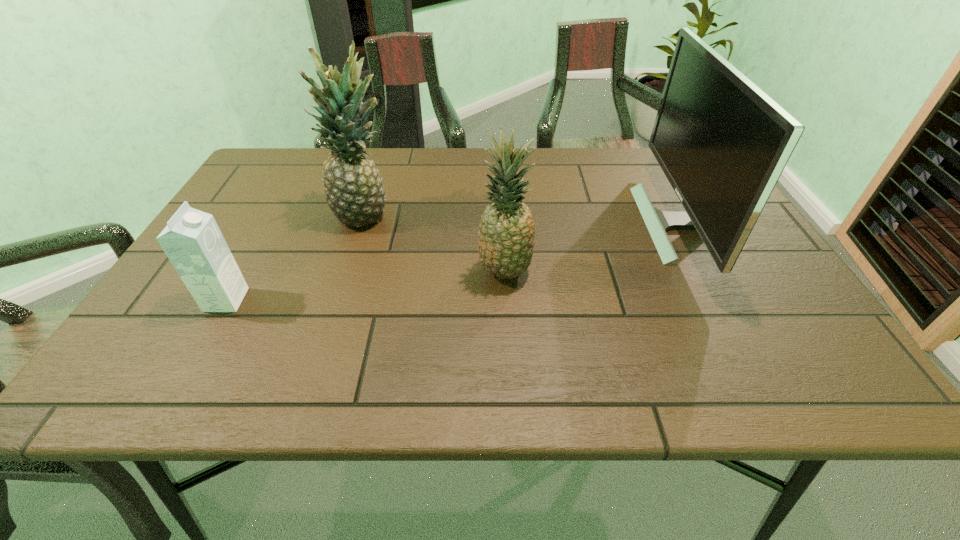
You are a GUI agent. You are given a task and a screenshot of the screen. Output one action in this format:
    pyautogui.click(x=<x>, y=<y>)
    Task: Click on the free point at the right edge
    
    Given the screenshot: What is the action you would take?
    pyautogui.click(x=791, y=309)

You are a GUI agent. You are given a task and a screenshot of the screen. Output one action in this format:
    pyautogui.click(x=<x>, y=<y>)
    Task: Click on the vacant space at the far left corner of the desktop
    This screenshot has width=960, height=540.
    Given the screenshot: What is the action you would take?
    pyautogui.click(x=276, y=187)

Find the location of a particular element. The image size is (960, 540). free space between the shortest object and the second object from left to right is located at coordinates click(x=295, y=258).

Locate an element on the screen. vacant area that lies between the leftmost object and the left pineapple is located at coordinates (295, 258).

I want to click on vacant space that is in between the left pineapple and the shortest object, so point(295,258).

The image size is (960, 540). What are the coordinates of `free space between the shorter pineapple and the farther pineapple` in the screenshot? It's located at 434,244.

Locate an element on the screen. Image resolution: width=960 pixels, height=540 pixels. free space between the left pineapple and the third object from left to right is located at coordinates (434, 244).

Locate an element on the screen. This screenshot has height=540, width=960. vacant region between the shortest object and the left pineapple is located at coordinates (295, 258).

You are a GUI agent. You are given a task and a screenshot of the screen. Output one action in this format:
    pyautogui.click(x=<x>, y=<y>)
    Task: Click on the blank region between the carton and the rightmost object
    This screenshot has height=540, width=960.
    Given the screenshot: What is the action you would take?
    pyautogui.click(x=452, y=262)

Image resolution: width=960 pixels, height=540 pixels. Identify the location of unoccupied area between the left pineapple and the second shortest object. (434, 244).